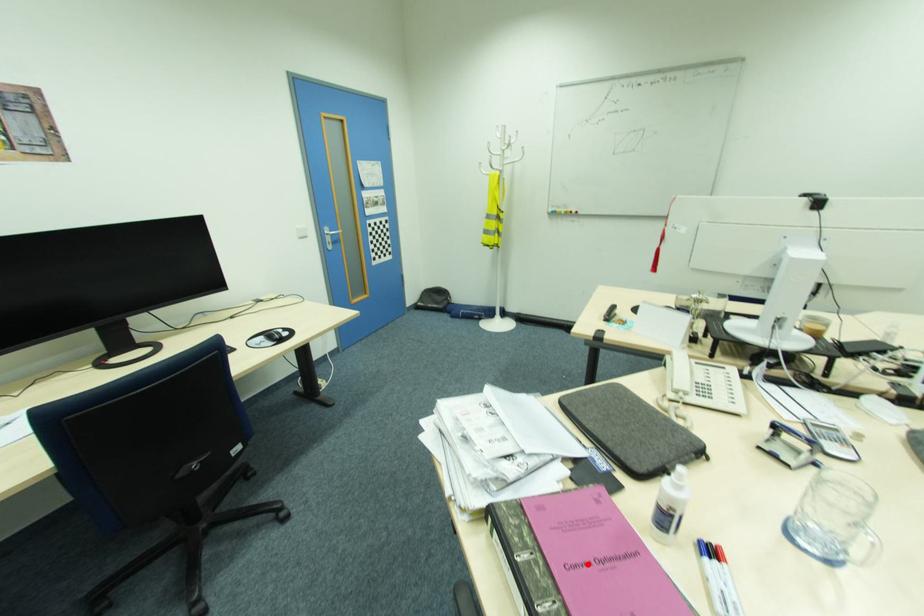
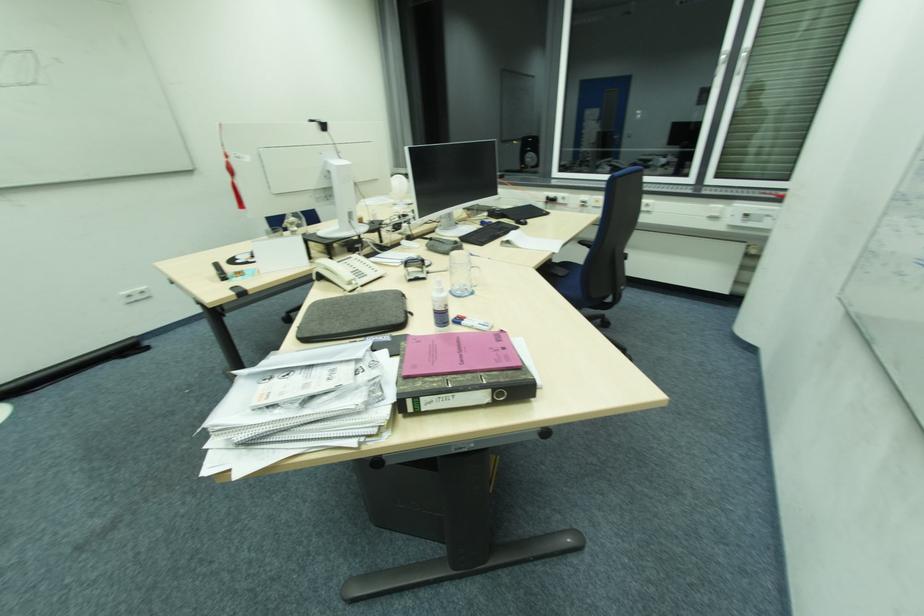
Where in the second image is the point corresponding to the highlighted location from the first image?

(465, 357)